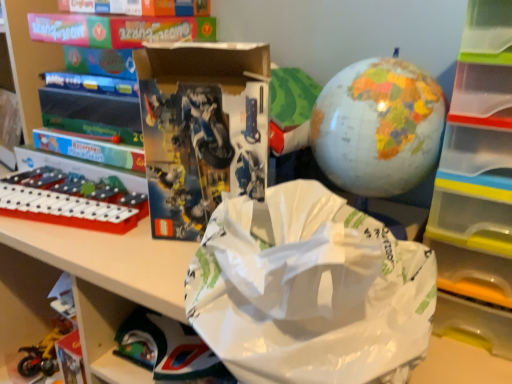
Question: From the image's perspective, is white paper grocery bag at center located above transparent plastic drawer at right?

Choices:
 (A) yes
 (B) no

Answer: (B)

Question: Considering the relative sizes of white paper grocery bag at center and transparent plastic drawer at right in the image provided, is white paper grocery bag at center taller than transparent plastic drawer at right?

Choices:
 (A) no
 (B) yes

Answer: (A)

Question: Considering the relative sizes of white paper grocery bag at center and transparent plastic drawer at right in the image provided, is white paper grocery bag at center bigger than transparent plastic drawer at right?

Choices:
 (A) yes
 (B) no

Answer: (B)

Question: Does white paper grocery bag at center lie behind transparent plastic drawer at right?

Choices:
 (A) no
 (B) yes

Answer: (A)

Question: Does white paper grocery bag at center have a lesser width compared to transparent plastic drawer at right?

Choices:
 (A) yes
 (B) no

Answer: (B)

Question: In terms of width, does matte black lego set at center look wider or thinner when compared to metallic yellow motorcycle at lower left, the third toy in the top-to-bottom sequence?

Choices:
 (A) thin
 (B) wide

Answer: (A)

Question: Is point (249, 99) positioned closer to the camera than point (17, 350)?

Choices:
 (A) farther
 (B) closer

Answer: (B)

Question: Would you say matte black lego set at center is to the left or to the right of metallic yellow motorcycle at lower left, the 3th toy in the right-to-left sequence, in the picture?

Choices:
 (A) left
 (B) right

Answer: (B)

Question: From a real-world perspective, is matte black lego set at center above or below metallic yellow motorcycle at lower left, the third toy in the top-to-bottom sequence?

Choices:
 (A) below
 (B) above

Answer: (B)

Question: Considering their positions, is white plastic tray at left, which is the 2th toy from right to left, located in front of or behind white paper grocery bag at center?

Choices:
 (A) front
 (B) behind

Answer: (B)

Question: Is point (74, 203) positioned closer to the camera than point (417, 311)?

Choices:
 (A) farther
 (B) closer

Answer: (A)

Question: Based on their positions, is white plastic tray at left, which ranks as the 2th toy in back-to-front order, located to the left or right of white paper grocery bag at center?

Choices:
 (A) right
 (B) left

Answer: (B)

Question: From their relative heights in the image, would you say white plastic tray at left, the second toy in the front-to-back sequence, is taller or shorter than white paper grocery bag at center?

Choices:
 (A) tall
 (B) short

Answer: (B)

Question: Considering the relative positions of transparent plastic drawer at right and matte black lego set at center in the image provided, is transparent plastic drawer at right to the left or to the right of matte black lego set at center?

Choices:
 (A) left
 (B) right

Answer: (B)

Question: Looking at their shapes, would you say transparent plastic drawer at right is wider or thinner than matte black lego set at center?

Choices:
 (A) wide
 (B) thin

Answer: (A)